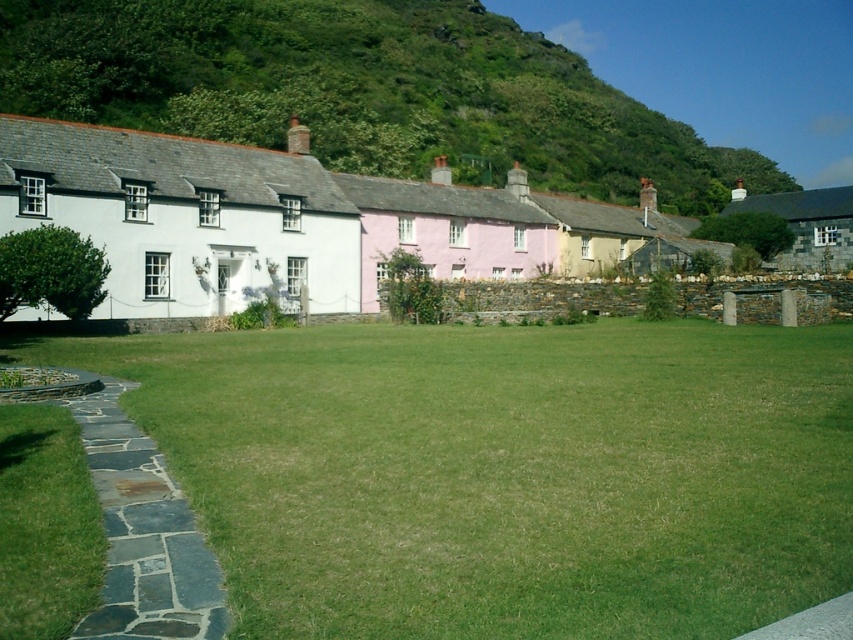
You are a traveler approaching the white matte cottage at left and the dark gray stone path at lower left. Which one appears larger in size?

The white matte cottage at left is bigger than the dark gray stone path at lower left, so it appears larger in size.

You are a tourist planning to take a photo of the green leafy hillside at upper center and the white matte cottage at left. Which object should you focus on first if you want to capture both in a single frame without moving the camera?

You should focus on the green leafy hillside at upper center first because it is larger in size compared to the white matte cottage at left, ensuring it fits well within the frame.